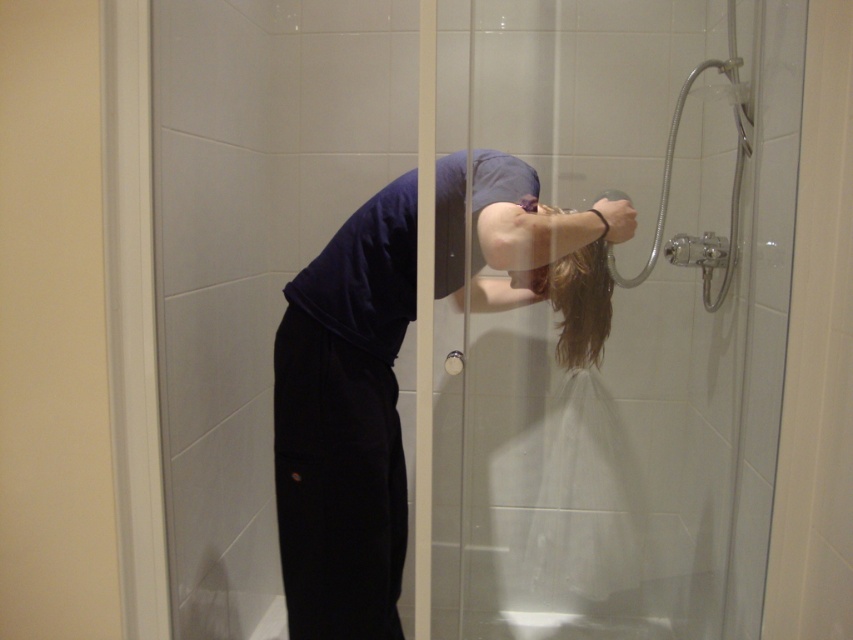
Question: In this image, where is dark blue fabric at center located relative to clear plastic hose at upper right?

Choices:
 (A) above
 (B) below

Answer: (B)

Question: Which point is closer to the camera?

Choices:
 (A) clear plastic hose at upper right
 (B) transparent glass door at upper center
 (C) dark blue fabric at center

Answer: (B)

Question: Is dark blue fabric at center positioned before clear plastic hose at upper right?

Choices:
 (A) yes
 (B) no

Answer: (A)

Question: Estimate the real-world distances between objects in this image. Which object is closer to the dark blue fabric at center?

Choices:
 (A) transparent glass door at upper center
 (B) clear plastic hose at upper right

Answer: (A)

Question: Which is nearer to the dark blue fabric at center?

Choices:
 (A) clear plastic hose at upper right
 (B) transparent glass door at upper center

Answer: (B)

Question: Is transparent glass door at upper center thinner than clear plastic hose at upper right?

Choices:
 (A) no
 (B) yes

Answer: (A)